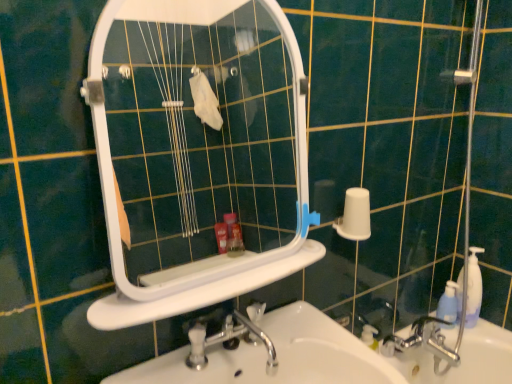
Question: Does blue translucent bottle at right have a greater height compared to white plastic mirror at upper center?

Choices:
 (A) no
 (B) yes

Answer: (A)

Question: From the image's perspective, is blue translucent bottle at right below white plastic mirror at upper center?

Choices:
 (A) no
 (B) yes

Answer: (B)

Question: Is blue translucent bottle at right to the left of white plastic mirror at upper center from the viewer's perspective?

Choices:
 (A) no
 (B) yes

Answer: (A)

Question: Is blue translucent bottle at right closer to camera compared to white plastic mirror at upper center?

Choices:
 (A) no
 (B) yes

Answer: (A)

Question: Is there a large distance between blue translucent bottle at right and white plastic mirror at upper center?

Choices:
 (A) yes
 (B) no

Answer: (A)

Question: Is blue translucent bottle at right in front of or behind white plastic ledge at center in the image?

Choices:
 (A) front
 (B) behind

Answer: (B)

Question: Is blue translucent bottle at right taller or shorter than white plastic ledge at center?

Choices:
 (A) short
 (B) tall

Answer: (B)

Question: Is blue translucent bottle at right wider or thinner than white plastic ledge at center?

Choices:
 (A) wide
 (B) thin

Answer: (B)

Question: Does point (449, 314) appear closer or farther from the camera than point (133, 302)?

Choices:
 (A) farther
 (B) closer

Answer: (A)

Question: Is white plastic ledge at center to the left or to the right of white glossy sink at lower center in the image?

Choices:
 (A) right
 (B) left

Answer: (B)

Question: Choose the correct answer: Is white plastic ledge at center inside white glossy sink at lower center or outside it?

Choices:
 (A) inside
 (B) outside

Answer: (B)

Question: From the image's perspective, is white plastic ledge at center above or below white glossy sink at lower center?

Choices:
 (A) above
 (B) below

Answer: (A)

Question: Is point (145, 301) positioned closer to the camera than point (278, 367)?

Choices:
 (A) closer
 (B) farther

Answer: (A)

Question: In the image, is white plastic mirror at upper center positioned in front of or behind white glossy sink at lower center?

Choices:
 (A) front
 (B) behind

Answer: (B)

Question: Choose the correct answer: Is white plastic mirror at upper center inside white glossy sink at lower center or outside it?

Choices:
 (A) outside
 (B) inside

Answer: (A)